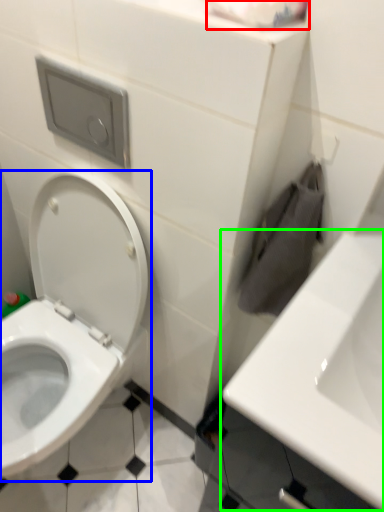
Question: Based on their relative distances, which object is nearer to toilet paper (highlighted by a red box)? Choose from toilet (highlighted by a blue box) and sink (highlighted by a green box).

Choices:
 (A) toilet
 (B) sink

Answer: (B)